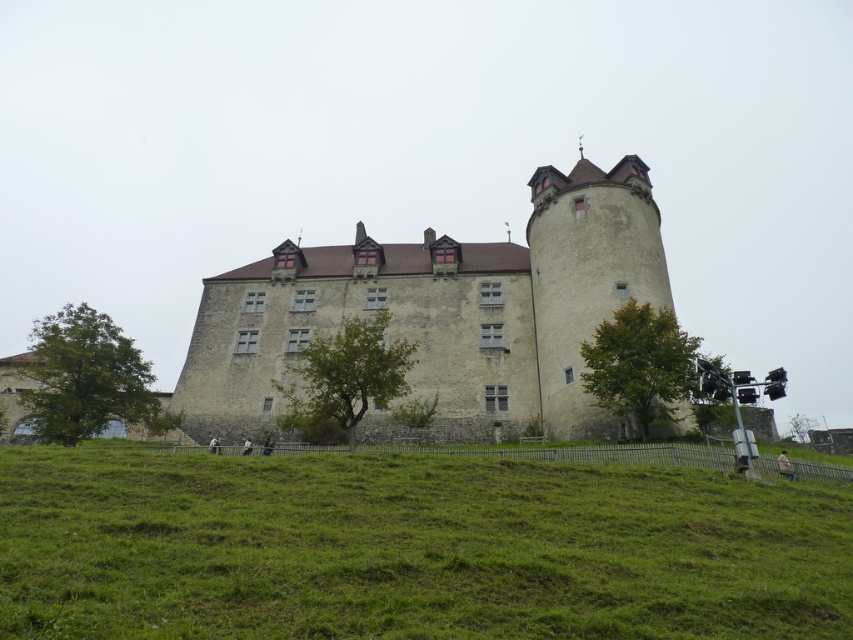
You are a tourist standing at the base of the hill looking up at the stone castle at center and the stone tower at right. Which structure appears taller from your vantage point?

The stone tower at right appears taller than the stone castle at center from your vantage point because the stone castle at center is shorter than the stone tower at right.

You are standing at the base of the hill where the stone castle at center is situated. If you want to take a photo of the castle from the front, which direction should you face?

Since the stone castle at center is located at point coordinates, you should face the direction where the castle is positioned to capture it from the front. However, without specific directional context, the general advice is to position yourself facing the main entrance or the central part of the castle structure for the best frontal view.